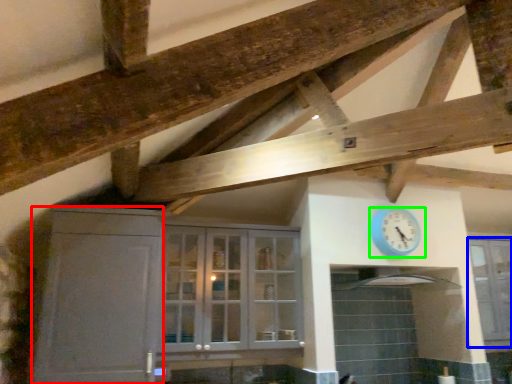
Question: Which object is positioned farthest from cabinetry (highlighted by a red box)? Select from window (highlighted by a blue box) and wall clock (highlighted by a green box).

Choices:
 (A) window
 (B) wall clock

Answer: (A)